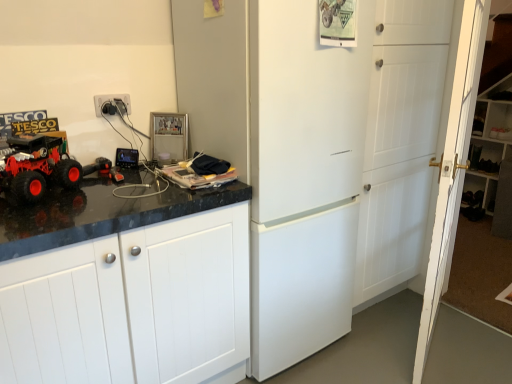
Question: Which is correct: metallic silver frame at upper center is inside white matte door at center, which appears as the 1th door when viewed from the left, or outside of it?

Choices:
 (A) outside
 (B) inside

Answer: (A)

Question: In the image, is metallic silver frame at upper center positioned in front of or behind white matte door at center, which appears as the 1th door when viewed from the left?

Choices:
 (A) behind
 (B) front

Answer: (A)

Question: Estimate the real-world distances between objects in this image. Which object is closer to the white plastic electric outlet at upper left?

Choices:
 (A) white wooden door at right, marked as the first door in a right-to-left arrangement
 (B) rubberized red truck at left
 (C) white matte door at center, the 2th door when ordered from right to left
 (D) white matte cabinet at left
 (E) white matte refrigerator at center

Answer: (B)

Question: Which is nearer to the white plastic electric outlet at upper left?

Choices:
 (A) white wooden door at right, the 2th door in the left-to-right sequence
 (B) metallic silver frame at upper center
 (C) white matte cabinet at left
 (D) rubberized red truck at left
 (E) white matte door at center, the 2th door when ordered from right to left

Answer: (B)